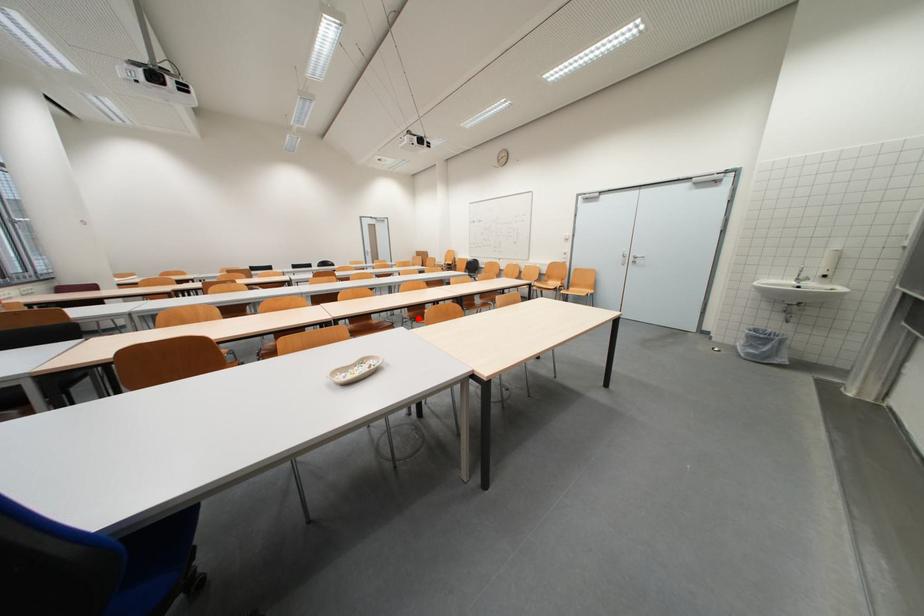
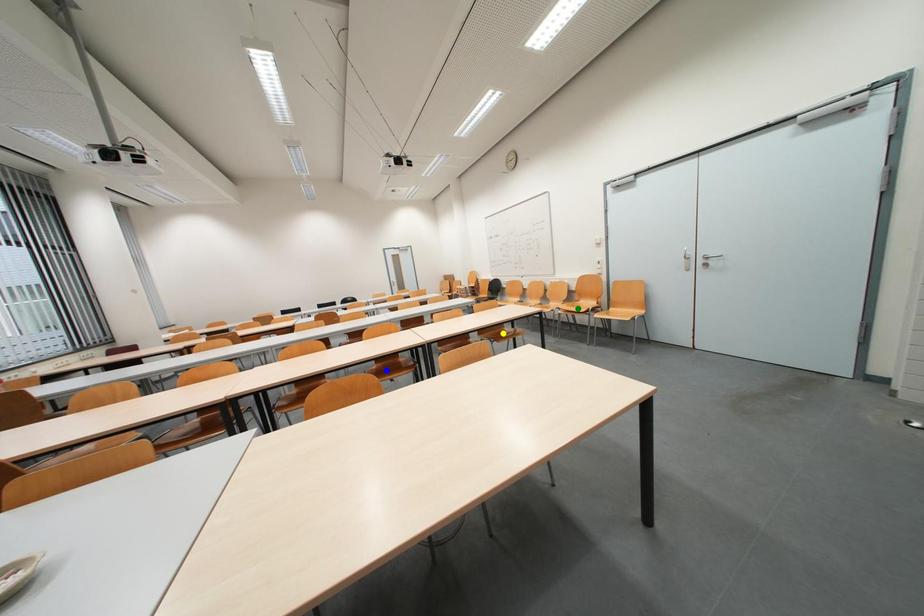
Question: I am providing you with two images of the same scene from different viewpoints. A red point is marked on the first image. You are given multiple points on the second image. Which mark in image 2 goes with the point in image 1?

Choices:
 (A) blue point
 (B) yellow point
 (C) green point

Answer: (A)